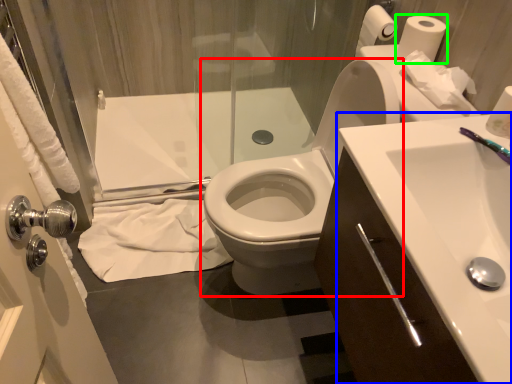
Question: Based on their relative distances, which object is nearer to toilet (highlighted by a red box)? Choose from sink (highlighted by a blue box) and toilet paper (highlighted by a green box).

Choices:
 (A) sink
 (B) toilet paper

Answer: (A)